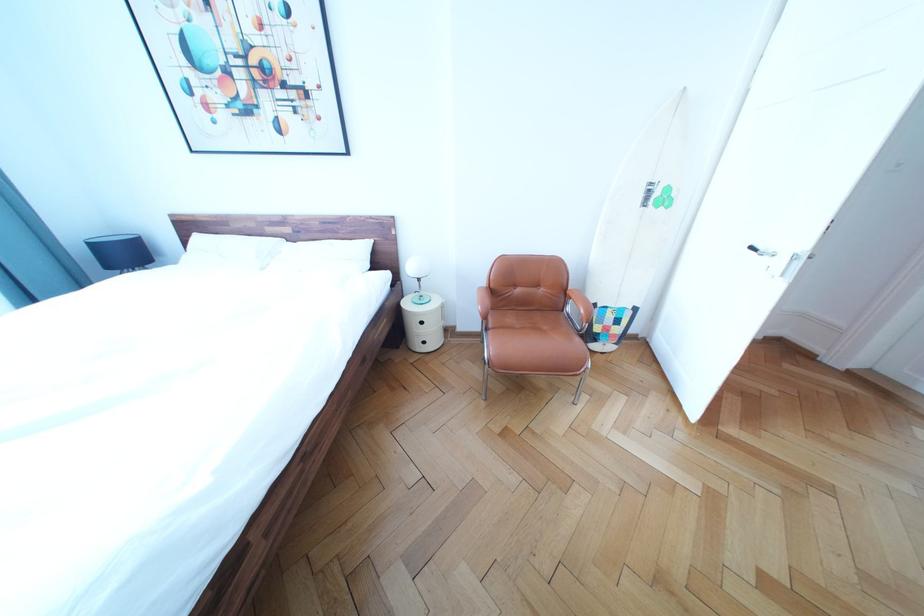
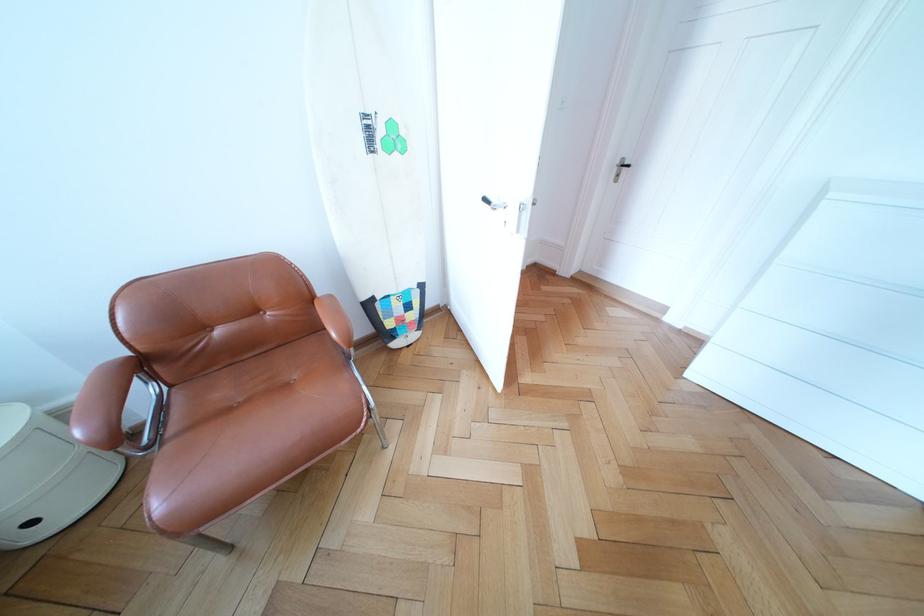
In the second image, find the point that corresponds to [434,349] in the first image.

(43, 529)